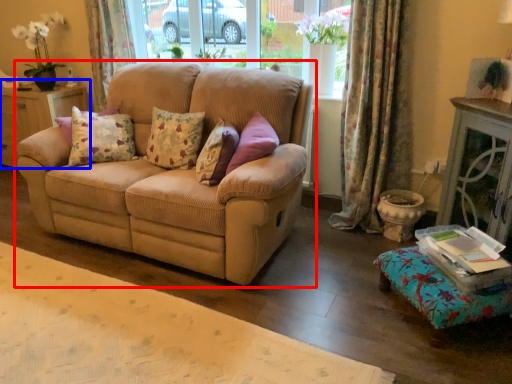
Question: Which object is further to the camera taking this photo, studio couch (highlighted by a red box) or dresser (highlighted by a blue box)?

Choices:
 (A) studio couch
 (B) dresser

Answer: (B)